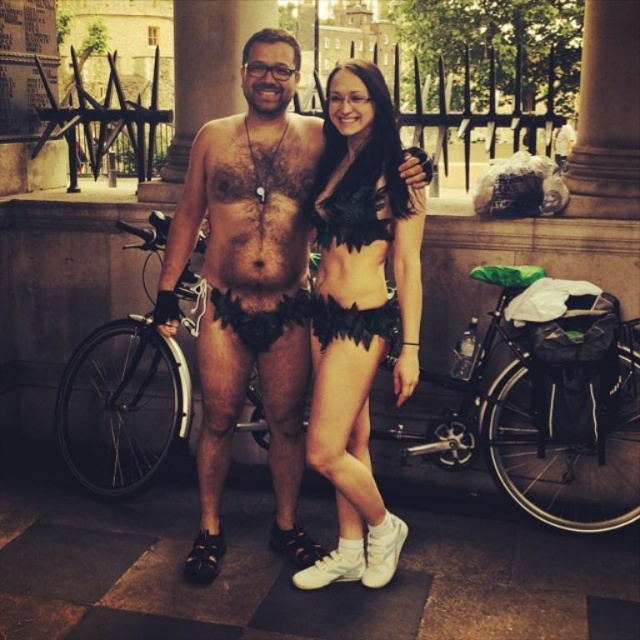
You are a photographer trying to frame a shot that includes both the leather shorts at center and the black feathered bikini top at center. Which object should you adjust your camera angle to focus on first if you want to ensure both are fully visible in the frame?

Since the leather shorts at center might be wider than the black feathered bikini top at center, you should focus on the leather shorts at center first to ensure the wider object fits within the frame before adjusting for the other.